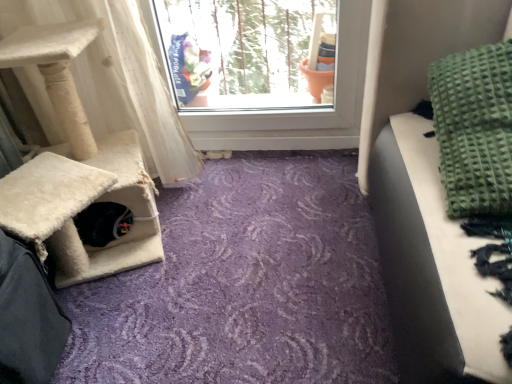
Question: Which is correct: white textured curtain at left is inside green textured blanket at upper right, or outside of it?

Choices:
 (A) inside
 (B) outside

Answer: (B)

Question: Looking at the image, does white textured curtain at left seem bigger or smaller compared to green textured blanket at upper right?

Choices:
 (A) big
 (B) small

Answer: (A)

Question: From the image's perspective, is white textured curtain at left positioned above or below green textured blanket at upper right?

Choices:
 (A) above
 (B) below

Answer: (B)

Question: Choose the correct answer: Is green textured blanket at upper right inside white textured curtain at left or outside it?

Choices:
 (A) inside
 (B) outside

Answer: (B)

Question: Relative to white textured curtain at left, is green textured blanket at upper right in front or behind?

Choices:
 (A) behind
 (B) front

Answer: (B)

Question: Visually, is green textured blanket at upper right positioned to the left or to the right of white textured curtain at left?

Choices:
 (A) left
 (B) right

Answer: (B)

Question: From a real-world perspective, is green textured blanket at upper right positioned above or below white textured curtain at left?

Choices:
 (A) above
 (B) below

Answer: (A)